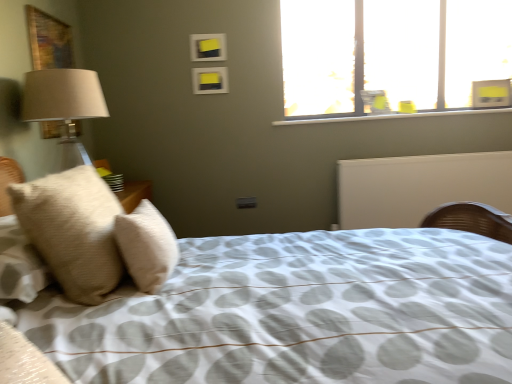
Question: From a real-world perspective, is white matte radiator at center located beneath beige textured pillow at left, the 2th pillow positioned from the right?

Choices:
 (A) no
 (B) yes

Answer: (B)

Question: Is beige textured pillow at left, which is the 1th pillow from left to right, at the back of white matte radiator at center?

Choices:
 (A) no
 (B) yes

Answer: (A)

Question: Would you say beige textured pillow at left, the 2th pillow positioned from the right, is part of white matte radiator at center's contents?

Choices:
 (A) yes
 (B) no

Answer: (B)

Question: Does white matte radiator at center lie in front of beige textured pillow at left, the 2th pillow positioned from the right?

Choices:
 (A) yes
 (B) no

Answer: (B)

Question: Considering the relative sizes of white matte radiator at center and beige textured pillow at left, which is the 1th pillow from left to right, in the image provided, is white matte radiator at center thinner than beige textured pillow at left, which is the 1th pillow from left to right,?

Choices:
 (A) no
 (B) yes

Answer: (B)

Question: Are white matte radiator at center and beige textured pillow at left, which is the 1th pillow from left to right, far apart?

Choices:
 (A) yes
 (B) no

Answer: (A)

Question: Can you confirm if transparent glass window at upper right is wider than beige soft pillow at left, arranged as the 1th pillow when viewed from the right?

Choices:
 (A) no
 (B) yes

Answer: (A)

Question: Considering the relative sizes of transparent glass window at upper right and beige soft pillow at left, which is the 2th pillow from left to right, in the image provided, is transparent glass window at upper right taller than beige soft pillow at left, which is the 2th pillow from left to right,?

Choices:
 (A) yes
 (B) no

Answer: (A)

Question: From a real-world perspective, is transparent glass window at upper right located higher than beige soft pillow at left, arranged as the 1th pillow when viewed from the right?

Choices:
 (A) yes
 (B) no

Answer: (A)

Question: From the image's perspective, is transparent glass window at upper right located beneath beige soft pillow at left, which is the 2th pillow from left to right?

Choices:
 (A) yes
 (B) no

Answer: (B)

Question: Is transparent glass window at upper right closer to the viewer compared to beige soft pillow at left, which is the 2th pillow from left to right?

Choices:
 (A) no
 (B) yes

Answer: (A)

Question: Considering the relative sizes of transparent glass window at upper right and beige soft pillow at left, which is the 2th pillow from left to right, in the image provided, is transparent glass window at upper right bigger than beige soft pillow at left, which is the 2th pillow from left to right,?

Choices:
 (A) no
 (B) yes

Answer: (B)

Question: From the image's perspective, does yellow matte picture frame at upper center, which is counted as the 1th picture frame, starting from the bottom, appear higher than white matte radiator at center?

Choices:
 (A) no
 (B) yes

Answer: (B)